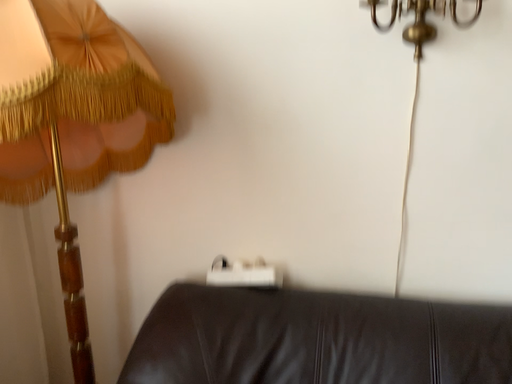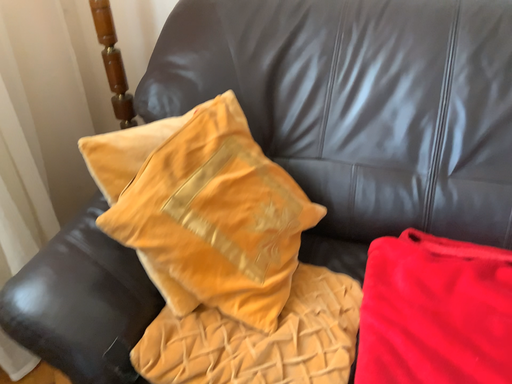
Question: Which way did the camera rotate in the video?

Choices:
 (A) rotated downward
 (B) rotated upward

Answer: (A)